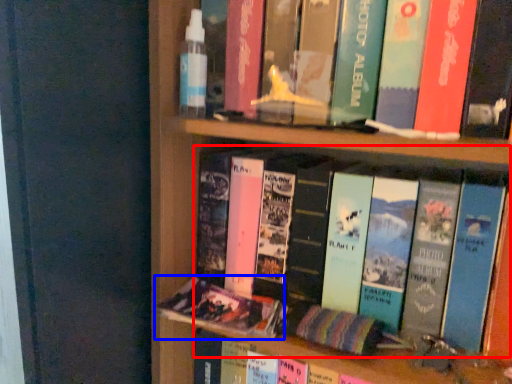
Question: Which object is further to the camera taking this photo, book (highlighted by a red box) or book (highlighted by a blue box)?

Choices:
 (A) book
 (B) book

Answer: (B)